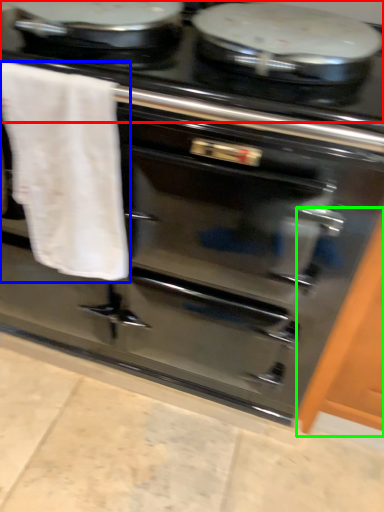
Question: Estimate the real-world distances between objects in this image. Which object is closer to gas stove (highlighted by a red box), bath towel (highlighted by a blue box) or cabinetry (highlighted by a green box)?

Choices:
 (A) bath towel
 (B) cabinetry

Answer: (A)